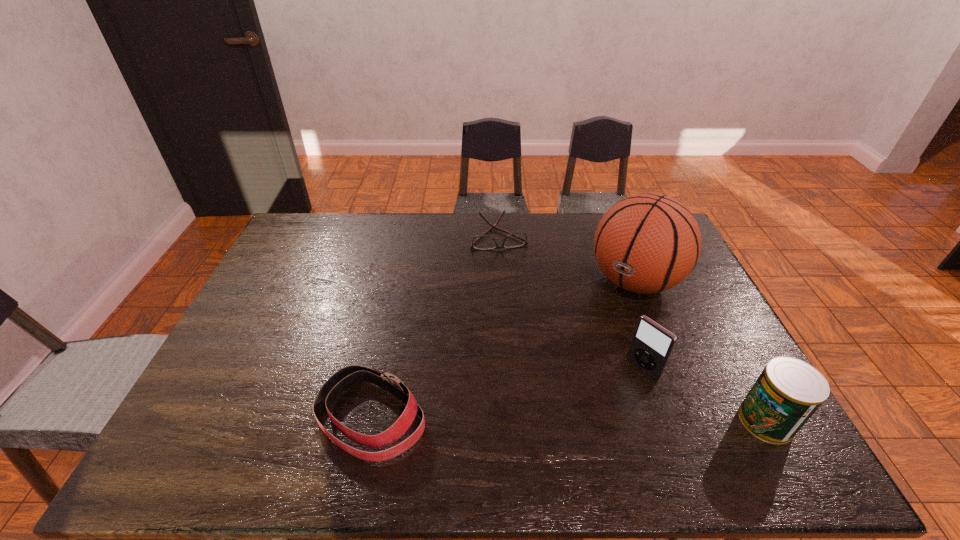
Point out which object is positioned as the second nearest to the second farthest object. Please provide its 2D coordinates. Your answer should be formatted as a tuple, i.e. [(x, y)], where the tuple contains the x and y coordinates of a point satisfying the conditions above.

[(518, 239)]

Where is `free space in the image that satisfies the following two spatial constraints: 1. on the back side of the iPod; 2. on the left side of the dog collar`? Image resolution: width=960 pixels, height=540 pixels. free space in the image that satisfies the following two spatial constraints: 1. on the back side of the iPod; 2. on the left side of the dog collar is located at coordinates (381, 369).

Image resolution: width=960 pixels, height=540 pixels. I want to click on blank area in the image that satisfies the following two spatial constraints: 1. on the front side of the iPod; 2. on the left side of the can, so [660, 421].